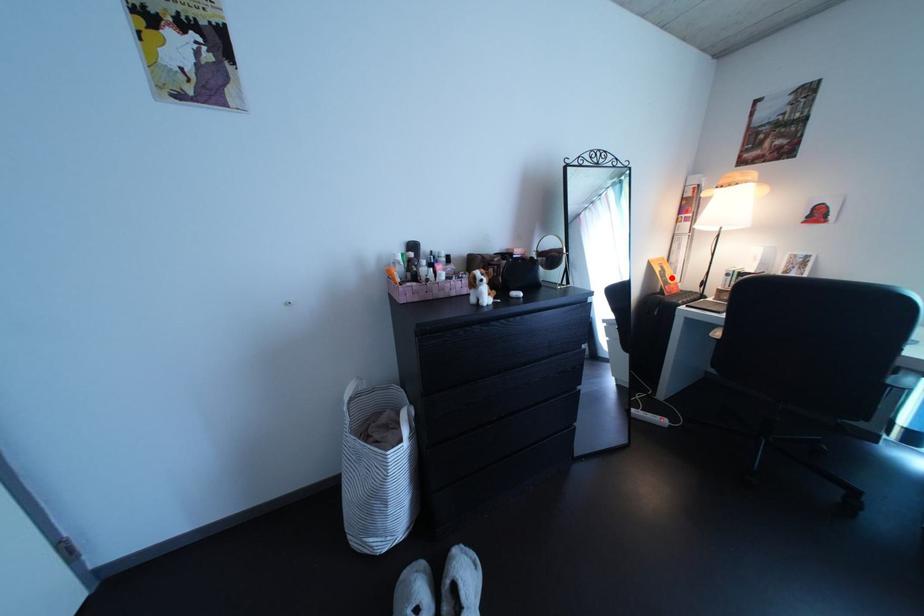
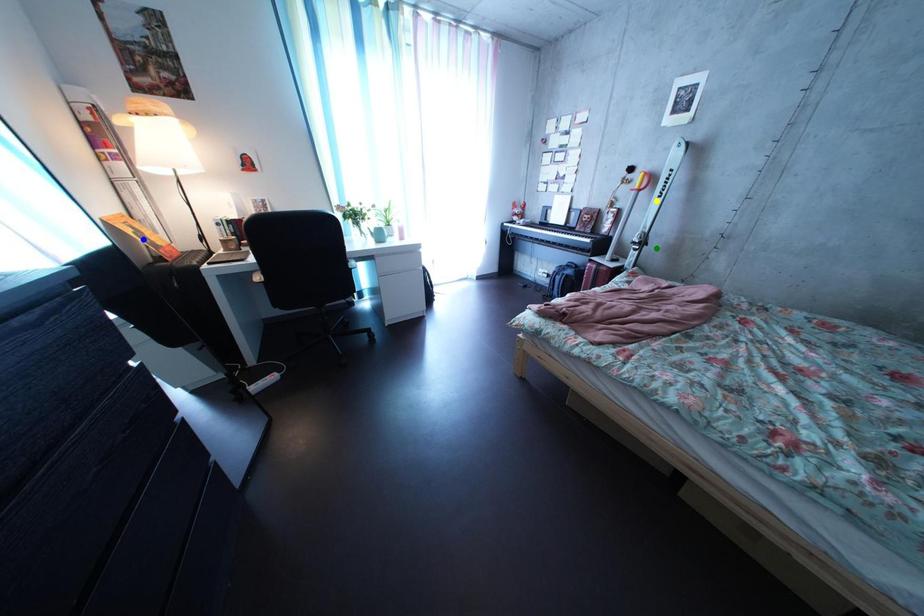
Question: I am providing you with two images of the same scene from different viewpoints. A red point is marked on the first image. You are given multiple points on the second image. In image 2, which mark is for the same physical point as the one in image 1?

Choices:
 (A) yellow point
 (B) green point
 (C) blue point

Answer: (C)